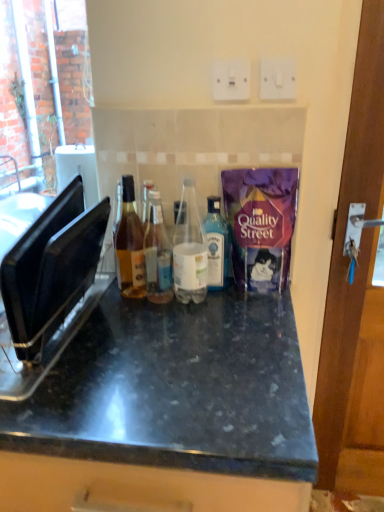
Identify the location of vacant area that lies between amber glass bottle at center, which is counted as the 4th bottle, starting from the right, and black plastic toaster at left. The image size is (384, 512). (108, 323).